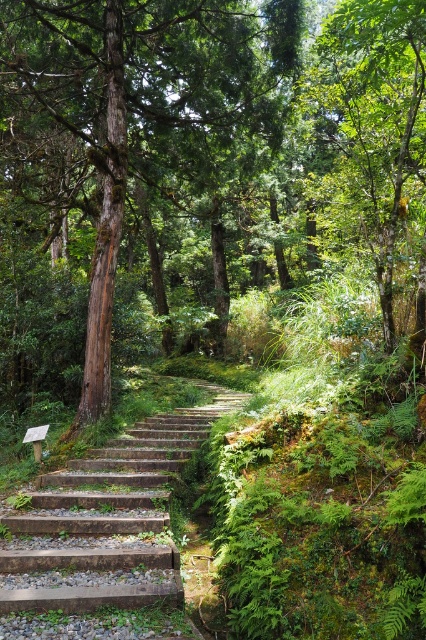
Question: Which of the following is the farthest from the observer?

Choices:
 (A) green leafy tree at upper center
 (B) stone steps at center

Answer: (A)

Question: Which object appears farthest from the camera in this image?

Choices:
 (A) stone steps at center
 (B) brown wood tree at center
 (C) green leafy tree at upper center

Answer: (B)

Question: Is stone steps at center above green leafy tree at upper center?

Choices:
 (A) no
 (B) yes

Answer: (A)

Question: Based on their relative distances, which object is nearer to the stone steps at center?

Choices:
 (A) green leafy tree at upper center
 (B) brown wood tree at center

Answer: (A)

Question: Where is stone steps at center located in relation to green leafy tree at upper center in the image?

Choices:
 (A) above
 (B) below

Answer: (B)

Question: Where is brown wood tree at center located in relation to green leafy tree at upper center in the image?

Choices:
 (A) below
 (B) above

Answer: (B)